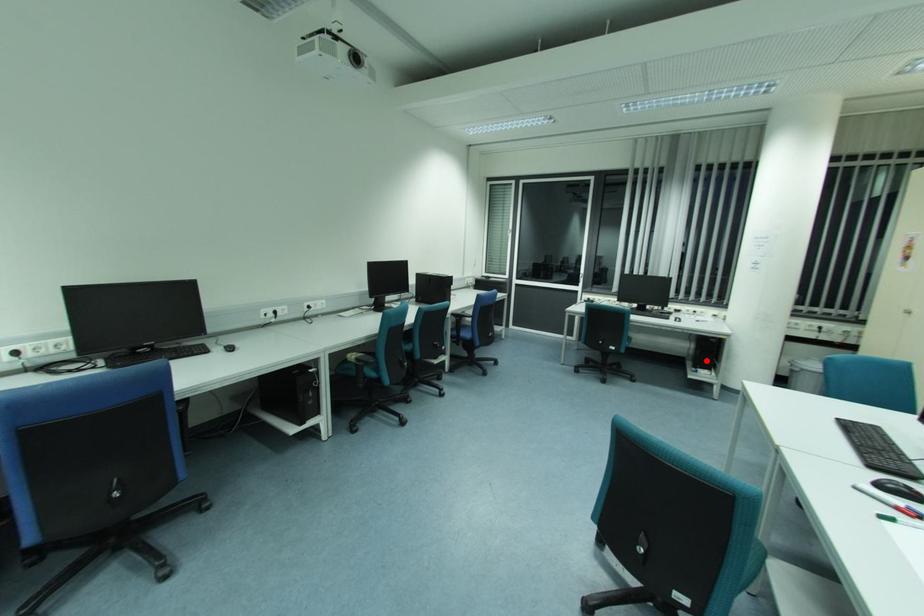
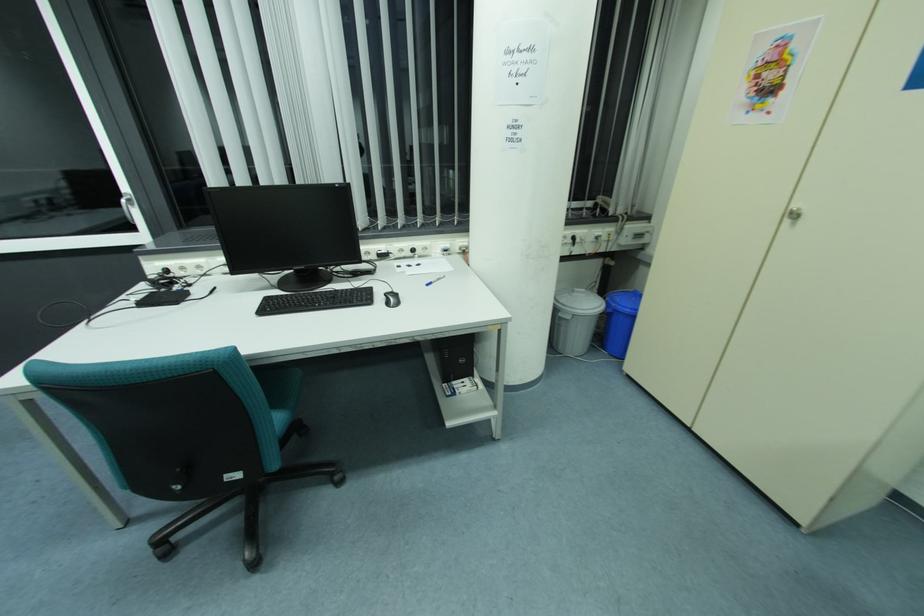
Question: I am providing you with two images of the same scene from different viewpoints. A red point is marked on the first image. Is the red point's position out of view in image 2?

Choices:
 (A) Yes
 (B) No

Answer: (B)